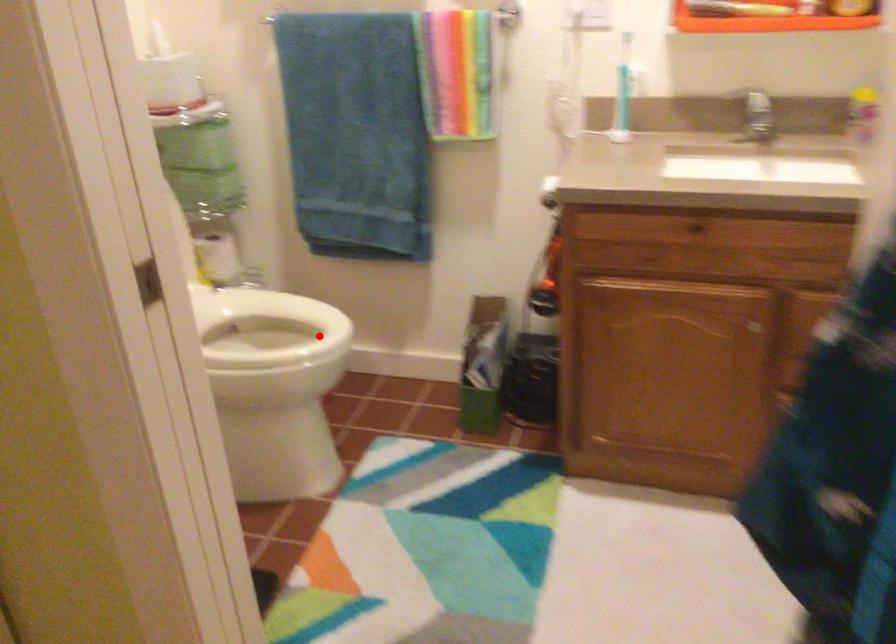
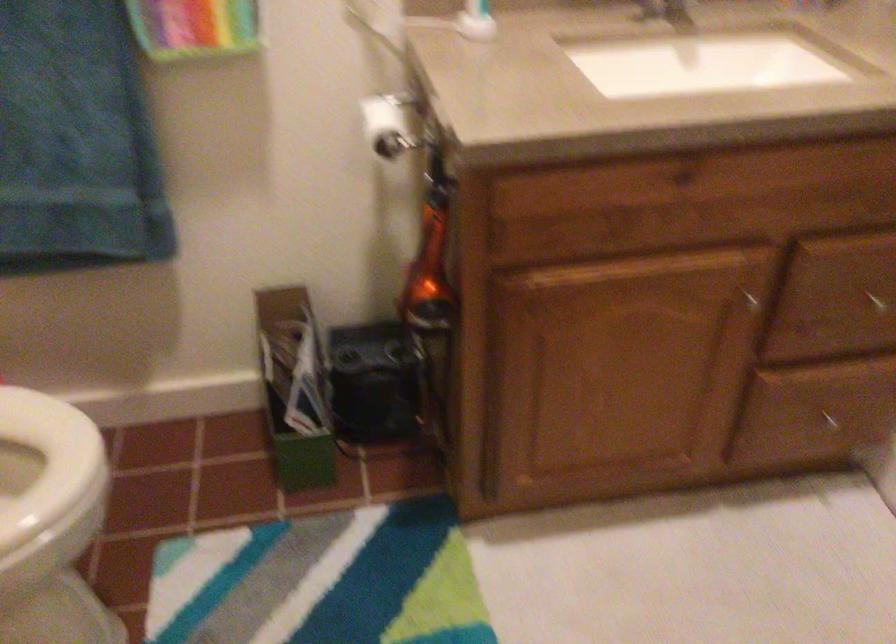
Question: I am providing you with two images of the same scene from different viewpoints. In image1, a red point is highlighted. Considering the same 3D point in image2, which of the following is correct?

Choices:
 (A) It is closer
 (B) It is farther

Answer: (A)